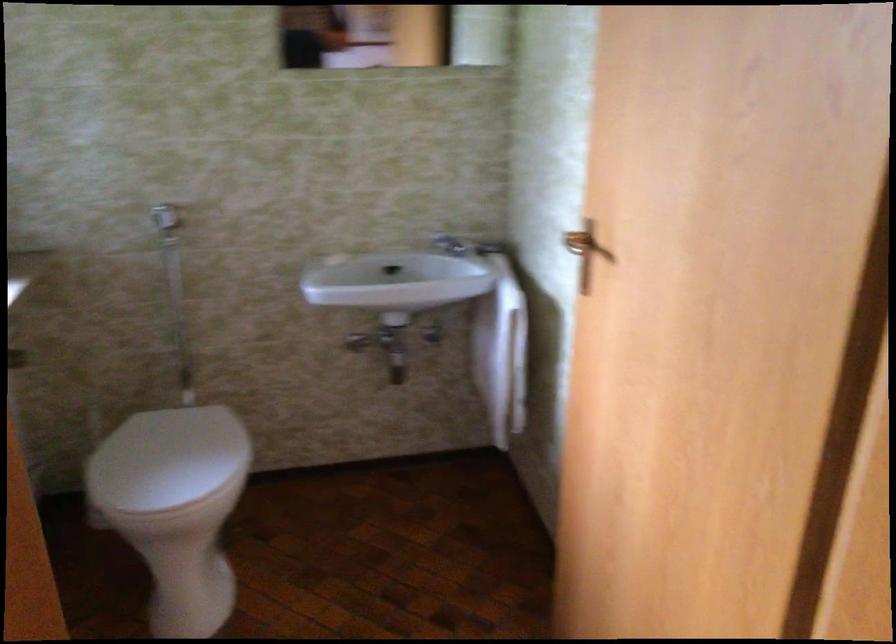
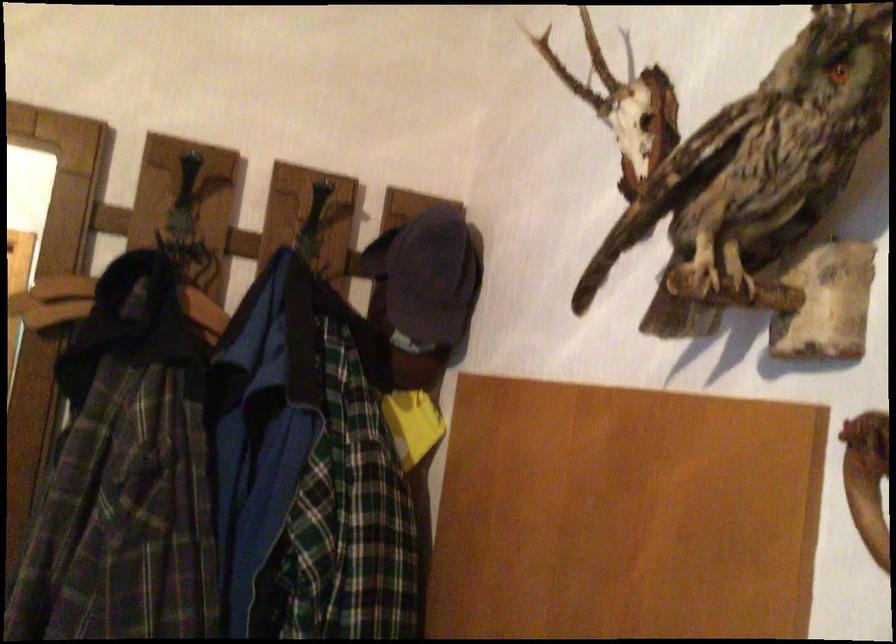
Question: Which direction would the cameraman need to move to produce the second image? Reply with the corresponding letter.

Choices:
 (A) Left
 (B) Right
 (C) Forward
 (D) Backward

Answer: (B)